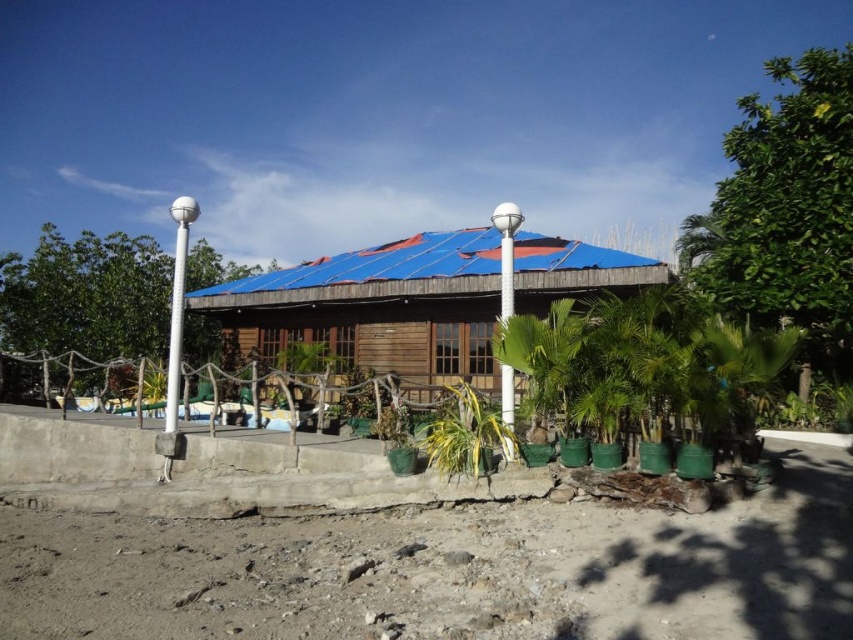
You are standing in front of the rustic wooden structure and want to take a photo of the green leafy palm tree at center. Which direction should you turn to ensure the green leafy tree at left is not blocking your view?

You should turn to the right side of the green leafy palm tree at center because the green leafy tree at left is located to its left, so turning right would position you away from the blocking tree.

You are standing on the raised concrete platform in front of the rustic wooden structure. You want to walk towards the green leafy palm tree at center. Which direction should you walk to avoid the green leafy tree at left blocking your path?

To reach the green leafy palm tree at center without the green leafy tree at left blocking your path, walk towards the center of the platform. Since the green leafy palm tree at center is behind the green leafy tree at left, moving towards the center allows you to bypass the tree on either side.